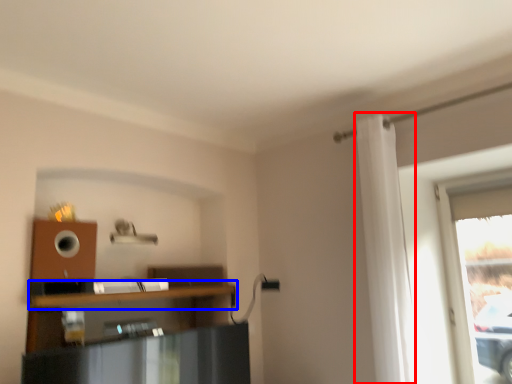
Question: Which object is closer to the camera taking this photo, curtain (highlighted by a red box) or shelf (highlighted by a blue box)?

Choices:
 (A) curtain
 (B) shelf

Answer: (B)